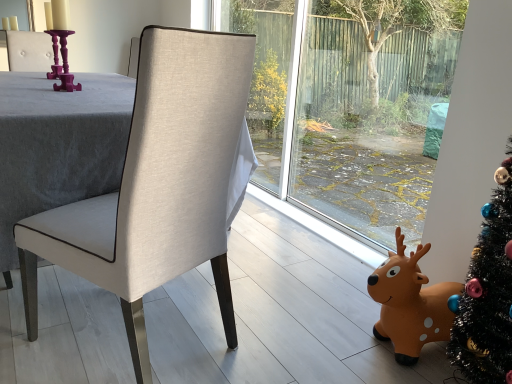
Where is `vacant space that's between matte beige fabric chair at center and orange rubber reindeer at lower right`? This screenshot has height=384, width=512. vacant space that's between matte beige fabric chair at center and orange rubber reindeer at lower right is located at coordinates (284, 330).